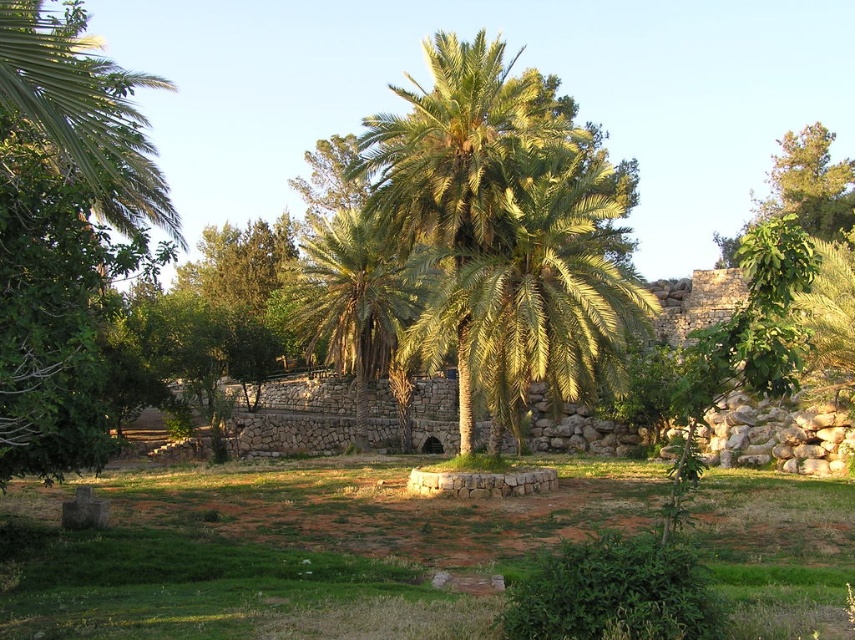
You are standing at the entrance of the garden and want to reach the green grass at center. Which direction should you walk to get there?

The green grass at center is located at point 0.863 on the x axis and 0.345 on the y axis. Since you are at the entrance, you should walk towards the center of the image to reach the green grass at center.